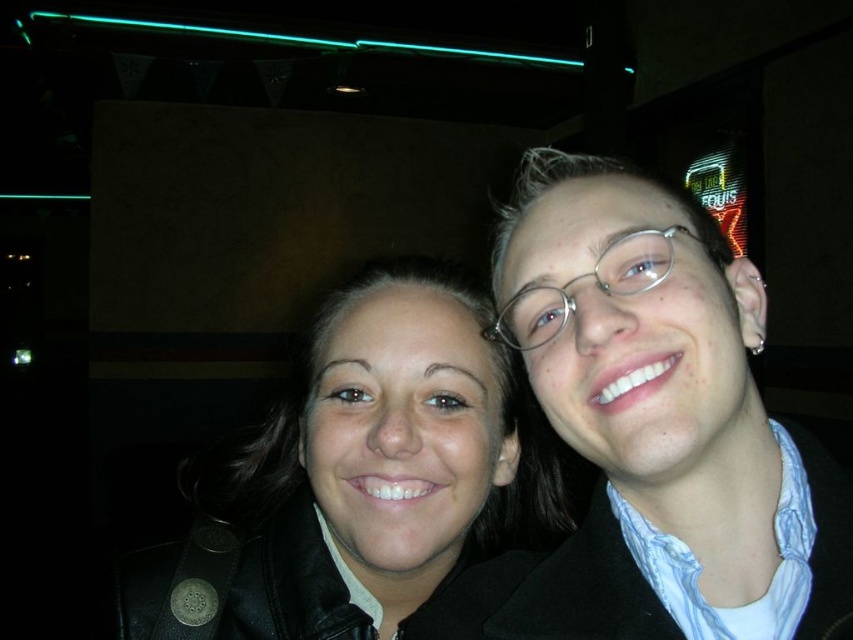
Question: Among these objects, which one is farthest from the camera?

Choices:
 (A) silver/glassy eyeglasses at center-right
 (B) matte black jacket at center
 (C) matte black jacket at right
 (D) black leather jacket at center

Answer: (B)

Question: Can you confirm if black leather jacket at center is positioned to the left of matte black jacket at center?

Choices:
 (A) no
 (B) yes

Answer: (A)

Question: Does matte black jacket at center lie behind silver/glassy eyeglasses at center-right?

Choices:
 (A) yes
 (B) no

Answer: (A)

Question: From the image, what is the correct spatial relationship of black leather jacket at center in relation to matte black jacket at center?

Choices:
 (A) left
 (B) right

Answer: (B)

Question: Which object is the closest to the matte black jacket at center?

Choices:
 (A) black leather jacket at center
 (B) matte black jacket at right

Answer: (A)

Question: Which object is the closest to the matte black jacket at center?

Choices:
 (A) matte black jacket at right
 (B) silver/glassy eyeglasses at center-right

Answer: (A)